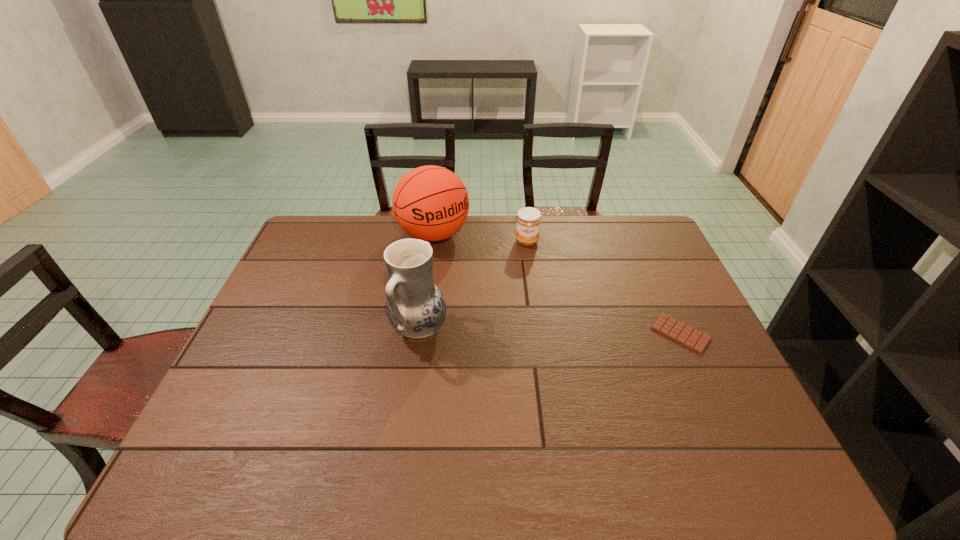
This screenshot has width=960, height=540. Find the location of `vacant space located on the front label of the third object from left to right`. vacant space located on the front label of the third object from left to right is located at coordinates (526, 258).

You are a GUI agent. You are given a task and a screenshot of the screen. Output one action in this format:
    pyautogui.click(x=<x>, y=<y>)
    Task: Click on the vacant area located 0.210m on the side with logo of the basketball
    
    Given the screenshot: What is the action you would take?
    pyautogui.click(x=482, y=289)

In order to click on vacant region located on the side with logo of the basketball in this screenshot , I will do `click(508, 319)`.

Identify the location of blank area located on the side with logo of the basketball. (482, 289).

You are a GUI agent. You are given a task and a screenshot of the screen. Output one action in this format:
    pyautogui.click(x=<x>, y=<y>)
    Task: Click on the jam that is at the far edge
    The width and height of the screenshot is (960, 540).
    Given the screenshot: What is the action you would take?
    tap(528, 223)

Identify the location of basketball present at the far edge. This screenshot has height=540, width=960. (430, 203).

Identify the location of object at the right edge. The height and width of the screenshot is (540, 960). (694, 339).

The width and height of the screenshot is (960, 540). I want to click on vacant space at the far edge, so click(x=549, y=234).

Find the location of `vacant area at the left edge`. vacant area at the left edge is located at coordinates click(278, 293).

In the image, there is a desktop. Find the location of `vacant space at the right edge`. vacant space at the right edge is located at coordinates (686, 368).